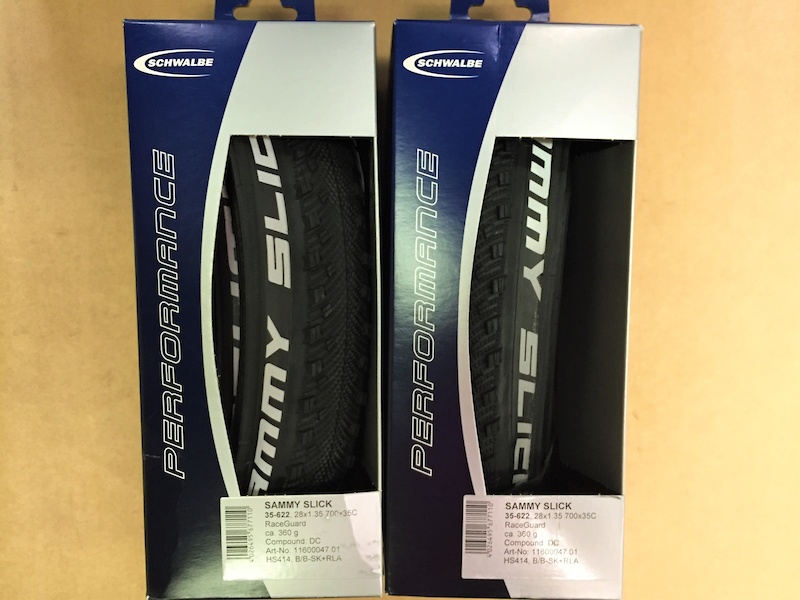
The width and height of the screenshot is (800, 600). Identify the location of blue hook. (230, 13), (460, 8).